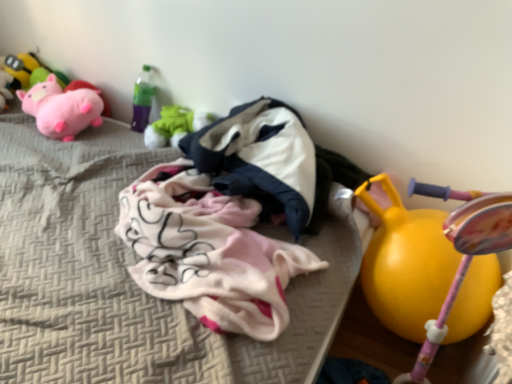
Question: From a real-world perspective, relative to matte pink plush at upper left, which ranks as the 3th toy in right-to-left order, is white cotton hoodie at center vertically above or below?

Choices:
 (A) below
 (B) above

Answer: (B)

Question: Is white cotton hoodie at center to the left or to the right of matte pink plush at upper left, which ranks as the 3th toy in right-to-left order, in the image?

Choices:
 (A) left
 (B) right

Answer: (B)

Question: Estimate the real-world distances between objects in this image. Which object is closer to the rubber yellow ball at right, which is counted as the fifth toy, starting from the left?

Choices:
 (A) matte pink plush at upper left, the third toy from the left
 (B) white cotton hoodie at center
 (C) matte yellow toy at upper left, which is counted as the 5th toy, starting from the right
 (D) white fabric at center
 (E) soft pink plush at upper left, acting as the fourth toy starting from the right

Answer: (B)

Question: Which object is the closest to the matte green plush toy at upper left, which appears as the fourth toy when viewed from the left?

Choices:
 (A) rubber yellow ball at right, which is counted as the fifth toy, starting from the left
 (B) soft pink plush at upper left, acting as the fourth toy starting from the right
 (C) white cotton hoodie at center
 (D) white fabric at center
 (E) matte yellow toy at upper left, which is counted as the 5th toy, starting from the right

Answer: (C)